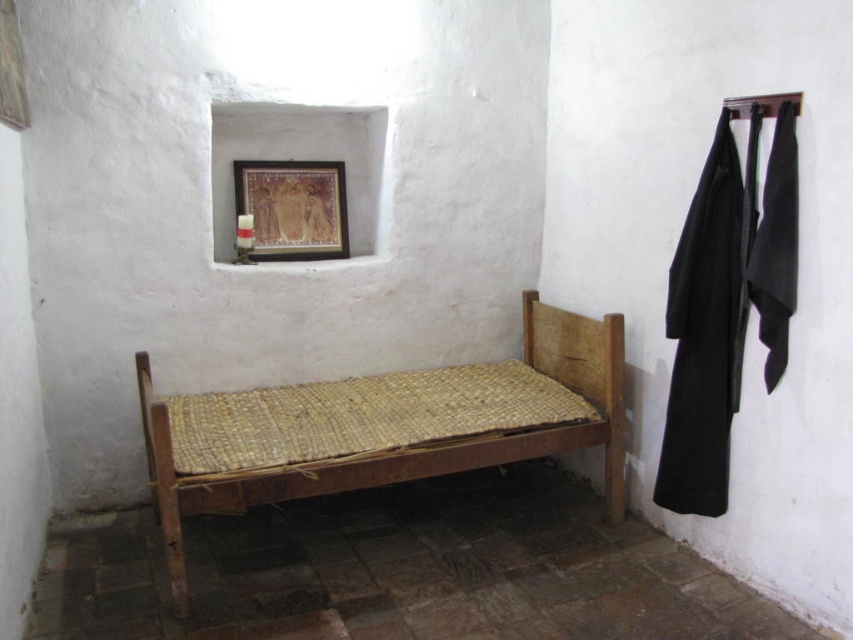
Question: Which object is closer to the camera taking this photo?

Choices:
 (A) wooden picture frame at upper center
 (B) wooden woven matress at center

Answer: (B)

Question: Does wooden woven matress at center appear over wooden picture frame at upper center?

Choices:
 (A) yes
 (B) no

Answer: (B)

Question: Which point appears farthest from the camera in this image?

Choices:
 (A) click(x=293, y=490)
 (B) click(x=233, y=166)

Answer: (B)

Question: Does wooden woven matress at center lie behind wooden picture frame at upper center?

Choices:
 (A) yes
 (B) no

Answer: (B)

Question: Which of the following is the closest to the observer?

Choices:
 (A) (315, 204)
 (B) (367, 477)

Answer: (B)

Question: Can you confirm if wooden woven matress at center is positioned above wooden picture frame at upper center?

Choices:
 (A) yes
 (B) no

Answer: (B)